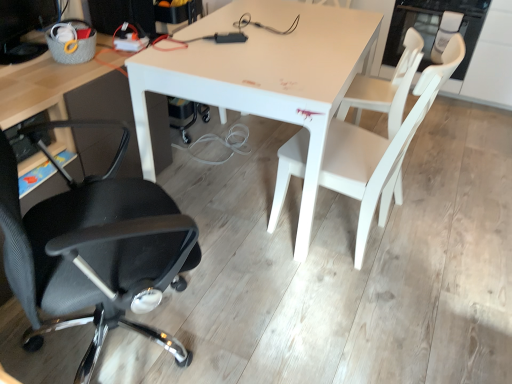
Locate an element on the screen. This screenshot has width=512, height=384. free space between white matte chair at center, the 2th chair in the left-to-right sequence, and black mesh office chair at left, arranged as the first chair when viewed from the left is located at coordinates (263, 287).